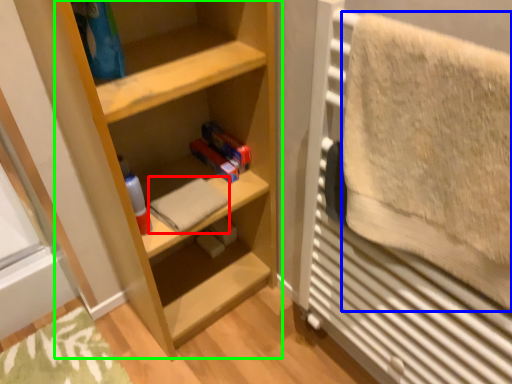
Question: Which object is the farthest from bath towel (highlighted by a red box)? Choose among these: bath towel (highlighted by a blue box) or shelf (highlighted by a green box).

Choices:
 (A) bath towel
 (B) shelf

Answer: (A)